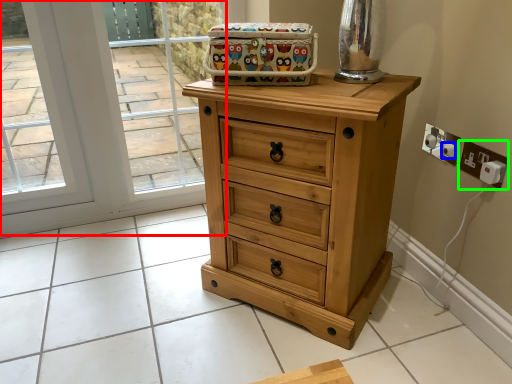
Question: Which is farther away from glass door (highlighted by a red box)? knob (highlighted by a blue box) or electric outlet (highlighted by a green box)?

Choices:
 (A) knob
 (B) electric outlet

Answer: (B)